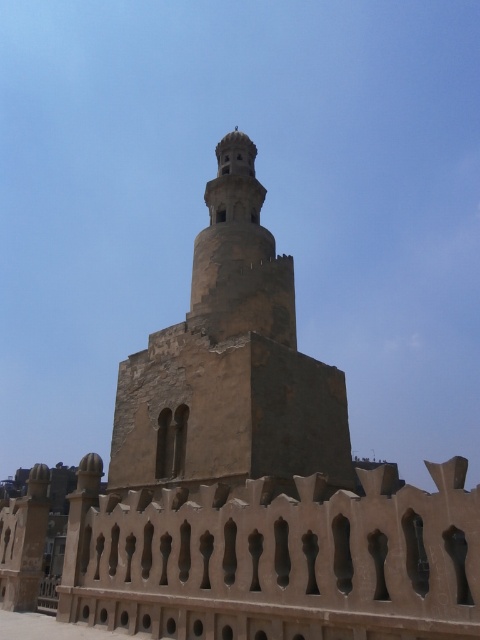
Can you confirm if brown stone fence at lower center is bigger than brown stone tower at center?

No, brown stone fence at lower center is not bigger than brown stone tower at center.

Between point (344, 611) and point (118, 404), which one is positioned in front?

Point (344, 611) is more forward.

The height and width of the screenshot is (640, 480). In order to click on brown stone fence at lower center in this screenshot , I will do `click(276, 557)`.